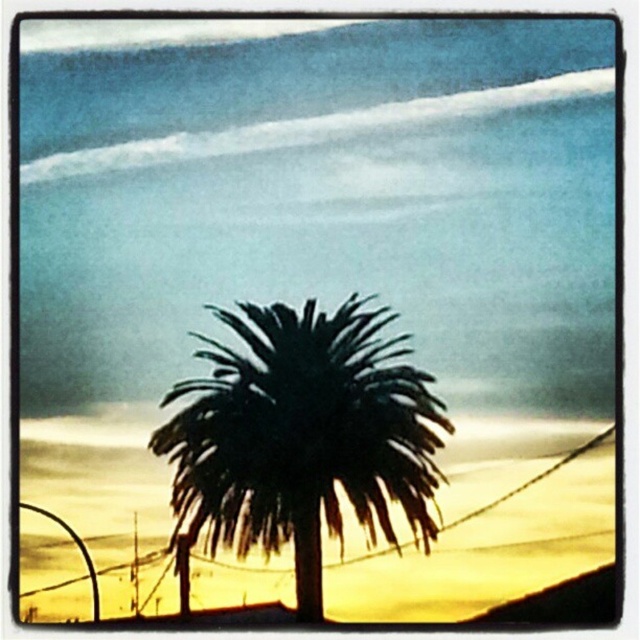
Is black wire at center wider than dark green leafy palm tree at center?

Yes, black wire at center is wider than dark green leafy palm tree at center.

At what (x,y) coordinates should I click in order to perform the action: click on black wire at center. Please return your answer as a coordinate pair (x, y). Image resolution: width=640 pixels, height=640 pixels. Looking at the image, I should click on (486, 525).

I want to click on black wire at center, so click(486, 525).